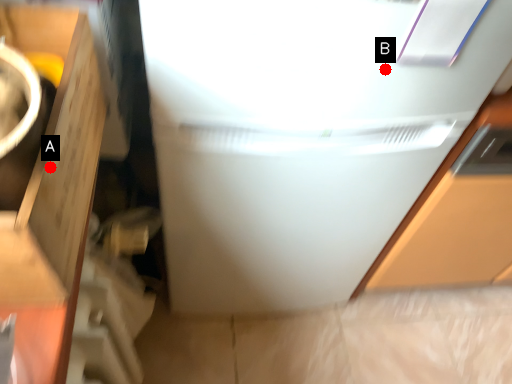
Question: Two points are circled on the image, labeled by A and B beside each circle. Among these points, which one is farthest from the camera?

Choices:
 (A) A is further
 (B) B is further

Answer: (B)